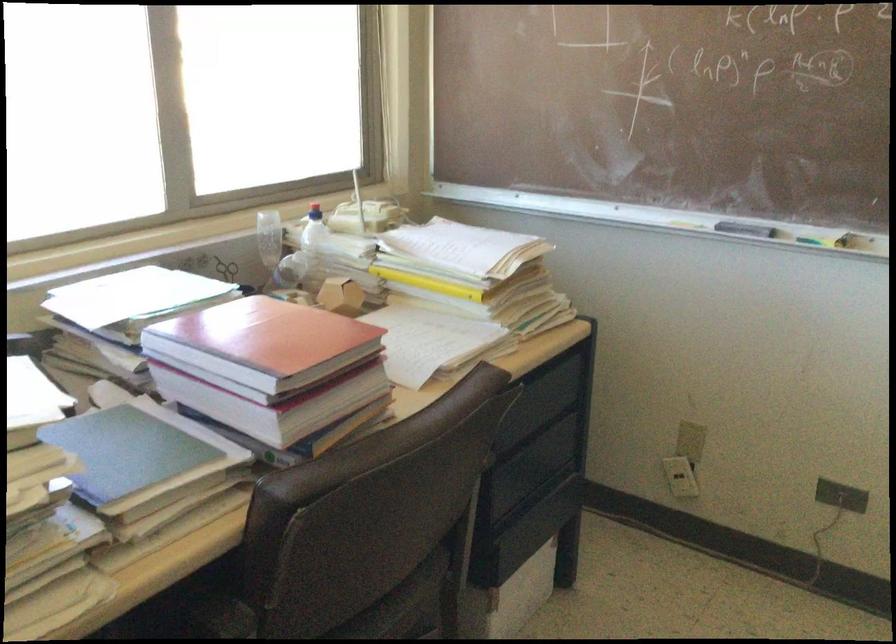
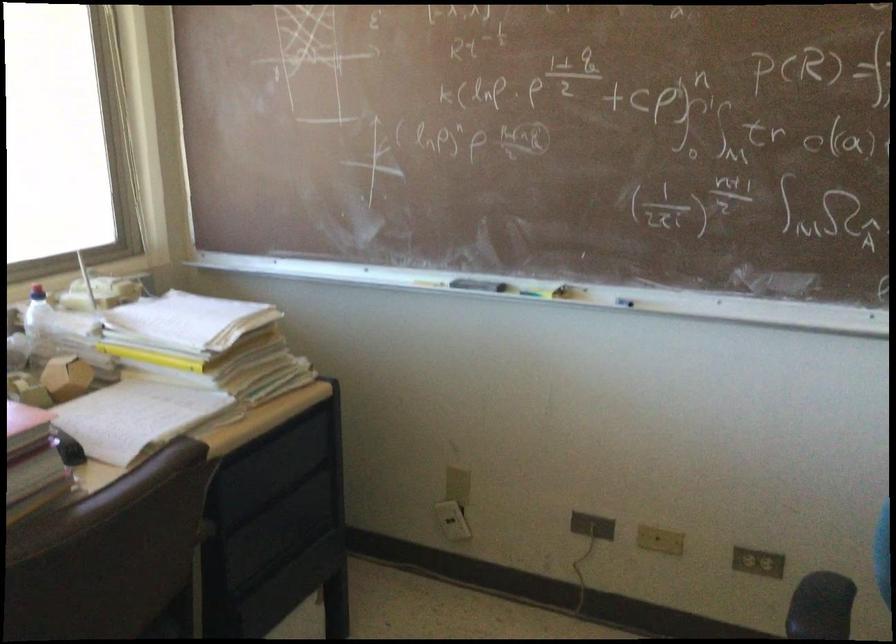
The point at (x=349, y=290) is marked in the first image. Where is the corresponding point in the second image?

(65, 377)